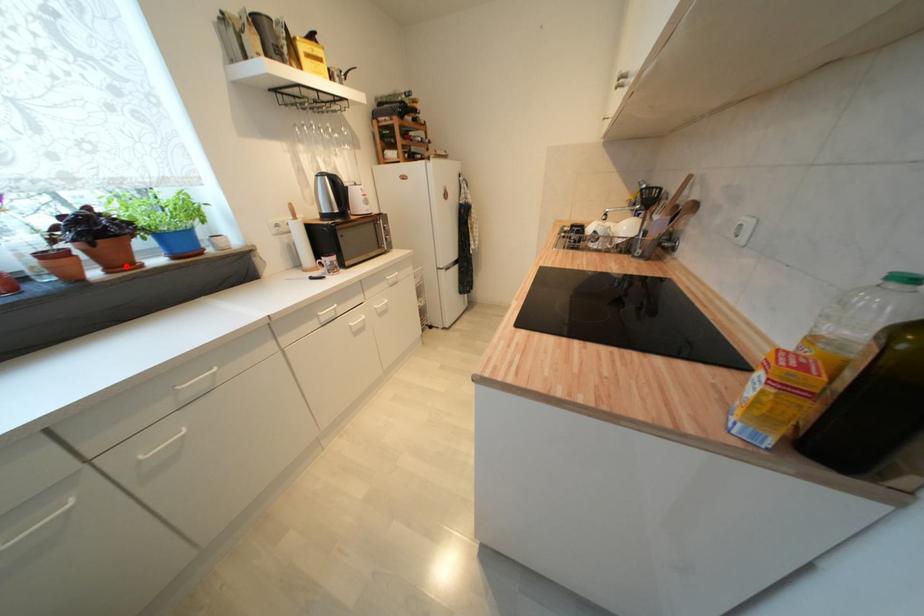
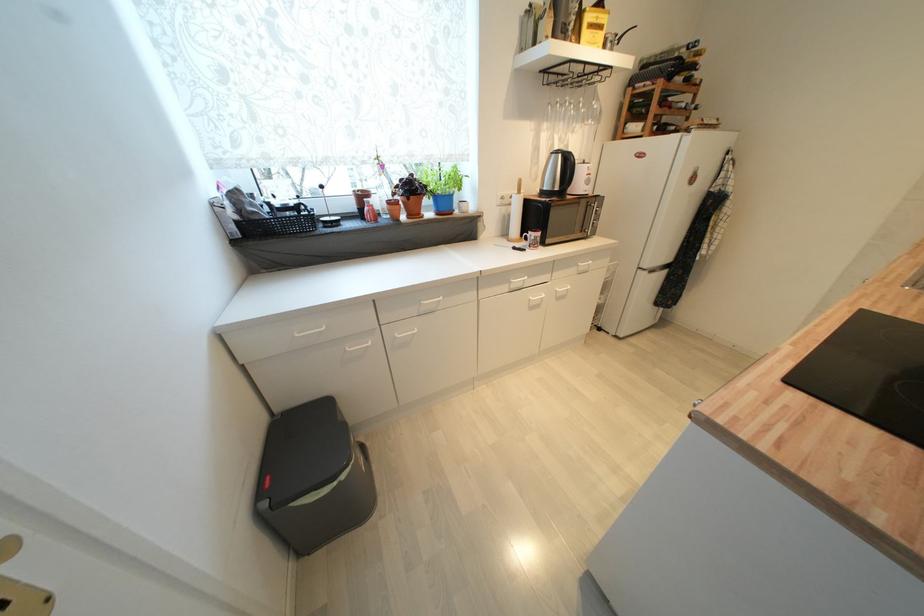
Find the pixel in the second image that matches the highlighted location in the first image.

(419, 216)